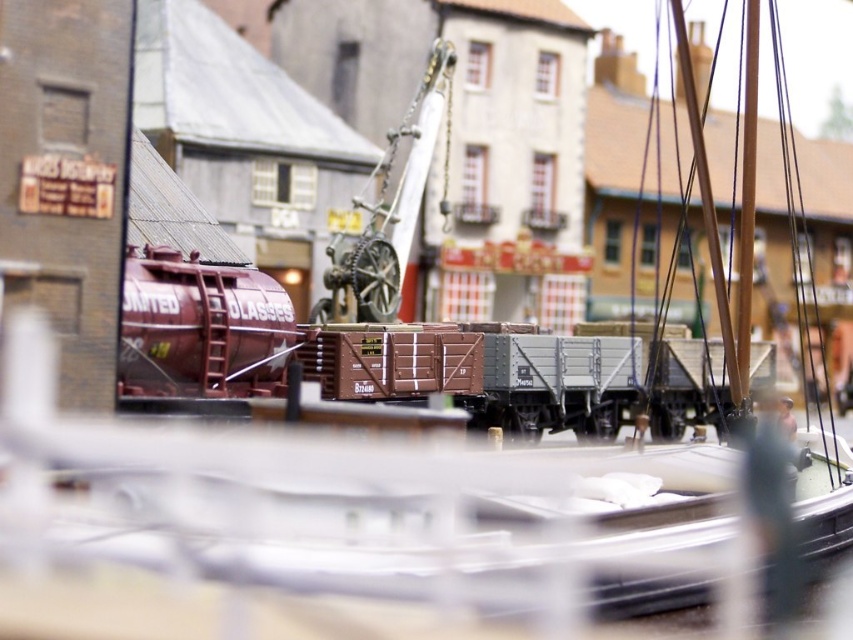
Question: Which point is closer to the camera?

Choices:
 (A) click(x=381, y=198)
 (B) click(x=228, y=298)

Answer: (B)

Question: Among these points, which one is nearest to the camera?

Choices:
 (A) (402, 230)
 (B) (279, 320)

Answer: (B)

Question: Does maroon metallic tank car at center have a greater width compared to metallic gray crane at center?

Choices:
 (A) yes
 (B) no

Answer: (A)

Question: Can you confirm if maroon metallic tank car at center is smaller than metallic gray crane at center?

Choices:
 (A) yes
 (B) no

Answer: (B)

Question: Observing the image, what is the correct spatial positioning of maroon metallic tank car at center in reference to metallic gray crane at center?

Choices:
 (A) below
 (B) above

Answer: (A)